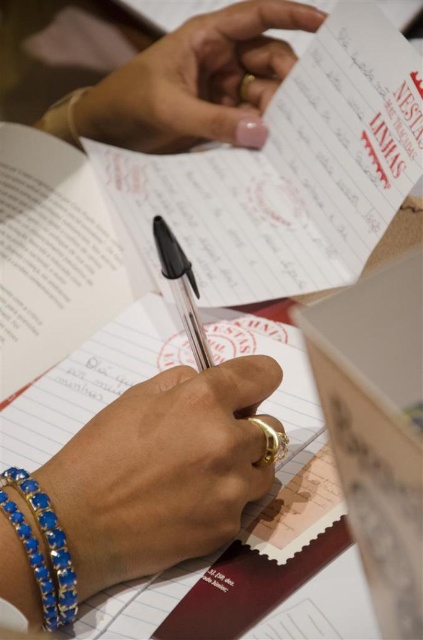
You are a nail technician observing the hands in the image. You need to determine which object has a greater width between the pink polished nails at upper center and the blue crystal bracelet at lower left without measuring tools. Based on the scene, which one is wider?

The pink polished nails at upper center are wider than the blue crystal bracelet at lower left according to the description.

You are observing someone writing a letter. You notice the gold ring at center and the pink polished nails at upper center. Which object is closer to the left side of the paper?

The gold ring at center is positioned on the left side of pink polished nails at upper center, so it is closer to the left side of the paper.

You are observing someone writing a document. You see the pink polished nails at upper center and the blue crystal bracelet at lower left. Which object is positioned more to the right side?

The pink polished nails at upper center is positioned more to the right side than the blue crystal bracelet at lower left.